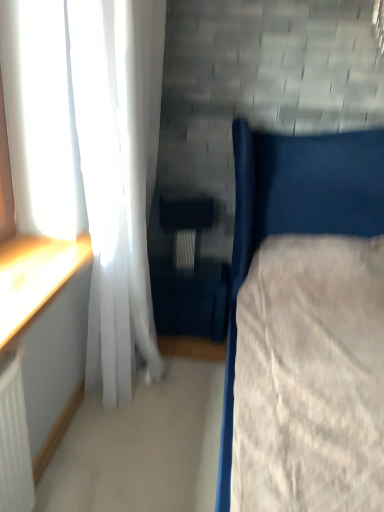
The width and height of the screenshot is (384, 512). I want to click on white sheer curtain at left, so click(118, 170).

The height and width of the screenshot is (512, 384). What do you see at coordinates (118, 170) in the screenshot? I see `white sheer curtain at left` at bounding box center [118, 170].

Where is `white sheer curtain at left`? white sheer curtain at left is located at coordinates coord(118,170).